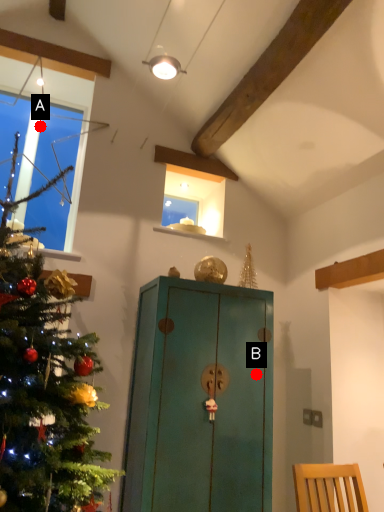
Question: Two points are circled on the image, labeled by A and B beside each circle. Which point is closer to the camera taking this photo?

Choices:
 (A) A is closer
 (B) B is closer

Answer: (B)